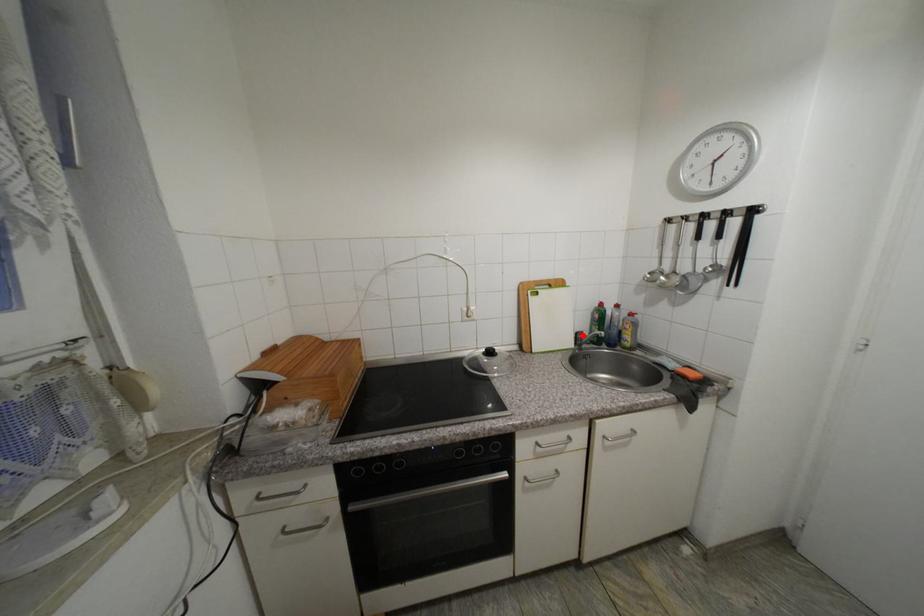
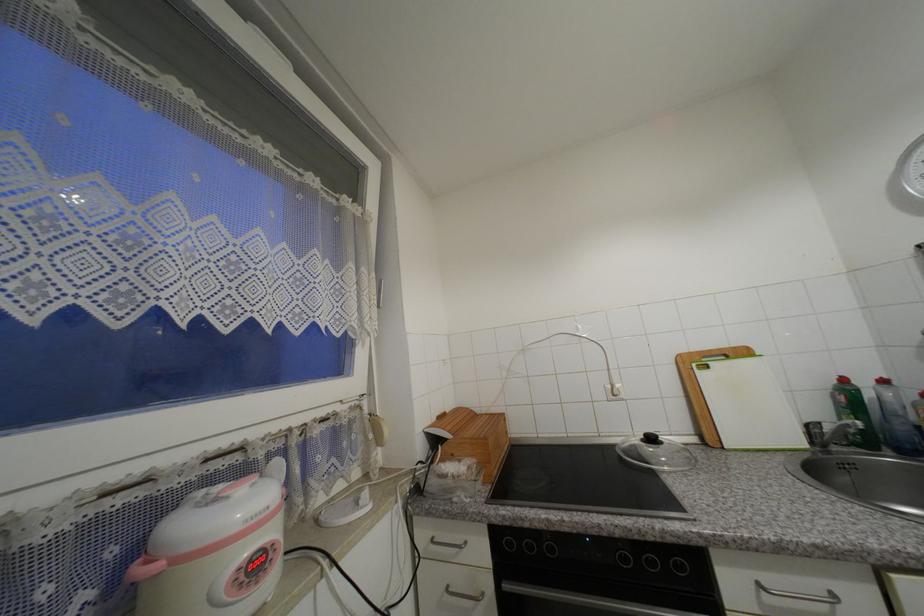
The point at the highlighted location is marked in the first image. Where is the corresponding point in the second image?

(812, 428)